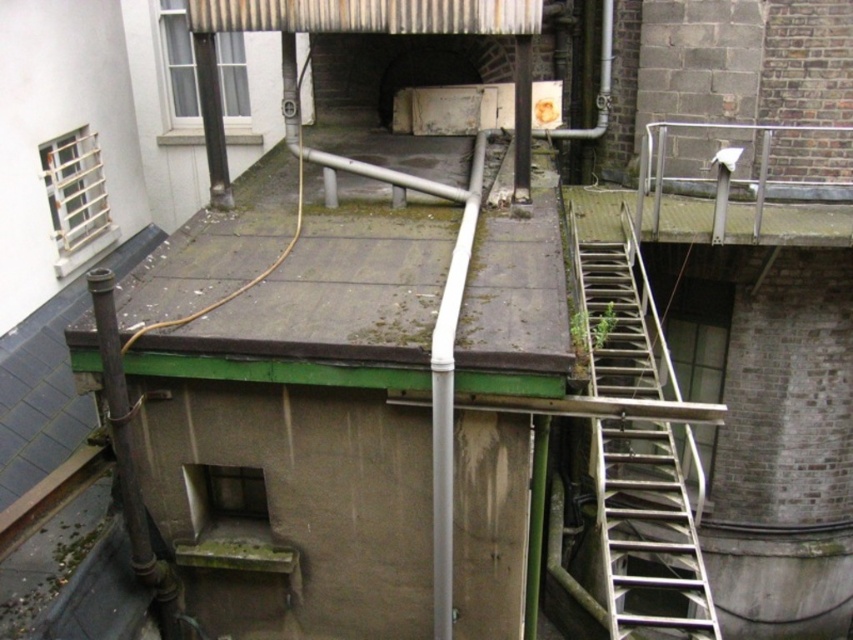
Is point (625, 262) behind point (456, 19)?

Yes, point (625, 262) is behind point (456, 19).

Who is more distant from viewer, (x=683, y=579) or (x=512, y=19)?

Point (x=683, y=579)

Is point (621, 371) positioned before point (247, 20)?

No, (621, 371) is behind (247, 20).

I want to click on metallic silver ladder at right, so pos(648,534).